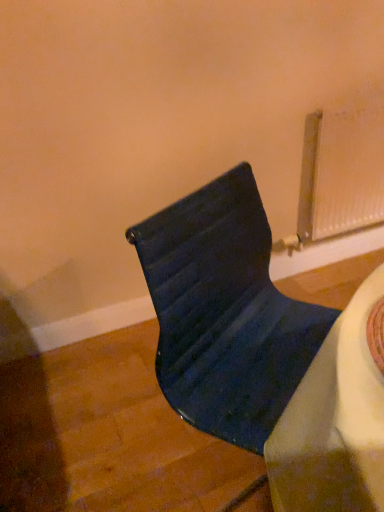
Where is `vacant area situated below glossy dark blue chair at center (from a real-world perspective)`? This screenshot has width=384, height=512. vacant area situated below glossy dark blue chair at center (from a real-world perspective) is located at coordinates (215, 472).